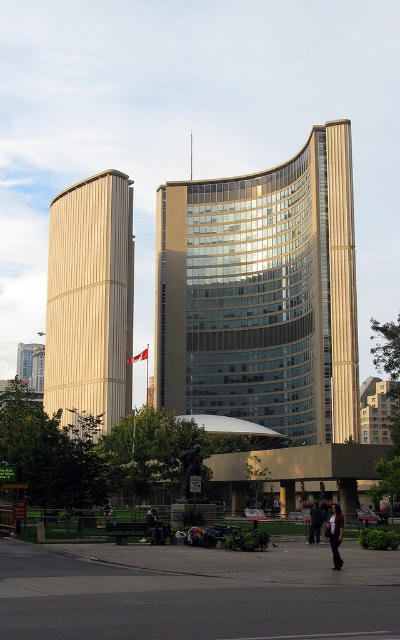
Between point (304, 289) and point (146, 352), which one is positioned in front?

Point (304, 289)

Can you confirm if glassy reflective building at center is bigger than red fabric flag at center?

Yes.

Who is more forward, [198,337] or [137,356]?

Point [137,356] is in front.

Find the location of `glassy reflective building at center`. glassy reflective building at center is located at coordinates (262, 294).

Does matte gold tower at left have a smaller size compared to black leather jacket at lower center?

Actually, matte gold tower at left might be larger than black leather jacket at lower center.

Which is above, matte gold tower at left or black leather jacket at lower center?

matte gold tower at left is higher up.

Locate an element on the screen. matte gold tower at left is located at coordinates (90, 300).

Locate an element on the screen. The height and width of the screenshot is (640, 400). matte gold tower at left is located at coordinates (90, 300).

Is the position of glassy reflective building at center less distant than that of dark blue jeans at lower center?

That is False.

Between glassy reflective building at center and dark blue jeans at lower center, which one has more height?

Standing taller between the two is glassy reflective building at center.

Between point (218, 349) and point (154, 531), which one is positioned in front?

Point (154, 531) is in front.

Find the location of `glassy reflective building at center`. glassy reflective building at center is located at coordinates (262, 294).